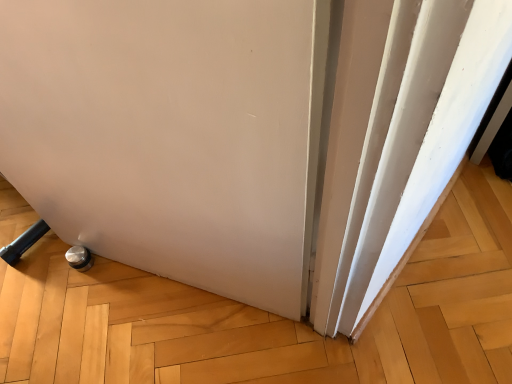
Locate an element on the screen. The image size is (512, 384). white matte door at lower left is located at coordinates (172, 134).

This screenshot has width=512, height=384. What do you see at coordinates (172, 134) in the screenshot? I see `white matte door at lower left` at bounding box center [172, 134].

At what (x,y) coordinates should I click in order to perform the action: click on white matte curtain at right. Please return your answer as a coordinate pair (x, y). This screenshot has width=512, height=384. Looking at the image, I should click on (414, 138).

The image size is (512, 384). What do you see at coordinates (414, 138) in the screenshot?
I see `white matte curtain at right` at bounding box center [414, 138].

Image resolution: width=512 pixels, height=384 pixels. What are the coordinates of `white matte door at lower left` in the screenshot? It's located at (172, 134).

Is white matte door at lower left to the right of white matte curtain at right from the viewer's perspective?

Incorrect, white matte door at lower left is not on the right side of white matte curtain at right.

Considering the relative positions of white matte door at lower left and white matte curtain at right in the image provided, is white matte door at lower left behind white matte curtain at right?

That is False.

Is point (37, 87) closer or farther from the camera than point (414, 45)?

Point (37, 87) appears to be farther away from the viewer than point (414, 45).

From the image's perspective, is white matte door at lower left positioned above or below white matte curtain at right?

Based on their image positions, white matte door at lower left is located beneath white matte curtain at right.

From a real-world perspective, is white matte door at lower left physically located above or below white matte curtain at right?

white matte door at lower left is above white matte curtain at right.

Can you confirm if white matte door at lower left is wider than white matte curtain at right?

No, white matte door at lower left is not wider than white matte curtain at right.

Between white matte door at lower left and white matte curtain at right, which one has less height?

white matte curtain at right.

Can you confirm if white matte door at lower left is bigger than white matte curtain at right?

Yes.

Is white matte door at lower left spatially inside white matte curtain at right, or outside of it?

white matte door at lower left is spatially situated outside white matte curtain at right.

Does white matte door at lower left touch white matte curtain at right?

white matte door at lower left is not next to white matte curtain at right, and they're not touching.

Could you tell me if white matte door at lower left is turned towards white matte curtain at right?

No, white matte door at lower left is not aimed at white matte curtain at right.

Can you tell me how much white matte door at lower left and white matte curtain at right differ in facing direction?

The facing directions of white matte door at lower left and white matte curtain at right are 0.591 degrees apart.

Image resolution: width=512 pixels, height=384 pixels. In order to click on door above the white matte curtain at right (from a real-world perspective) in this screenshot , I will do 172,134.

Considering the relative positions of white matte curtain at right and white matte door at lower left in the image provided, is white matte curtain at right to the left of white matte door at lower left from the viewer's perspective?

No.

Considering their positions, is white matte curtain at right located in front of or behind white matte door at lower left?

In the image, white matte curtain at right appears behind white matte door at lower left.

Which is nearer, (420, 184) or (242, 256)?

Point (420, 184) is closer to the camera than point (242, 256).

From the image's perspective, is white matte curtain at right located above or below white matte door at lower left?

Clearly, from the image's perspective, white matte curtain at right is above white matte door at lower left.

From a real-world perspective, is white matte curtain at right above or below white matte door at lower left?

white matte curtain at right is situated lower than white matte door at lower left in the real world.

Between white matte curtain at right and white matte door at lower left, which one has larger width?

white matte curtain at right is wider.

Is white matte curtain at right shorter than white matte door at lower left?

Correct, white matte curtain at right is not as tall as white matte door at lower left.

Is white matte curtain at right smaller than white matte door at lower left?

Correct, white matte curtain at right occupies less space than white matte door at lower left.

Looking at this image, is white matte curtain at right not inside white matte door at lower left?

Yes, white matte curtain at right is located beyond the bounds of white matte door at lower left.

Is white matte curtain at right next to white matte door at lower left?

No, white matte curtain at right is not touching white matte door at lower left.

Based on the photo, is white matte curtain at right oriented towards white matte door at lower left?

No, white matte curtain at right is not facing towards white matte door at lower left.

What's the angular difference between white matte curtain at right and white matte door at lower left's facing directions?

0.591 degrees.

How distant is white matte curtain at right from white matte door at lower left?

white matte curtain at right and white matte door at lower left are 11.00 inches apart from each other.

I want to click on curtain on the right of white matte door at lower left, so click(x=414, y=138).

The width and height of the screenshot is (512, 384). Identify the location of door in front of the white matte curtain at right. (172, 134).

The image size is (512, 384). Find the location of `curtain behind the white matte door at lower left`. curtain behind the white matte door at lower left is located at coordinates (414, 138).